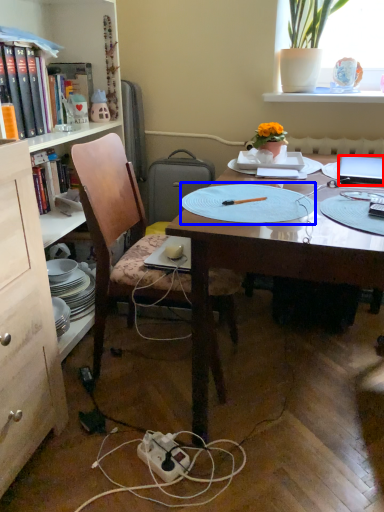
Question: Which object appears farthest to the camera in this image, laptop (highlighted by a red box) or paper plate (highlighted by a blue box)?

Choices:
 (A) laptop
 (B) paper plate

Answer: (A)